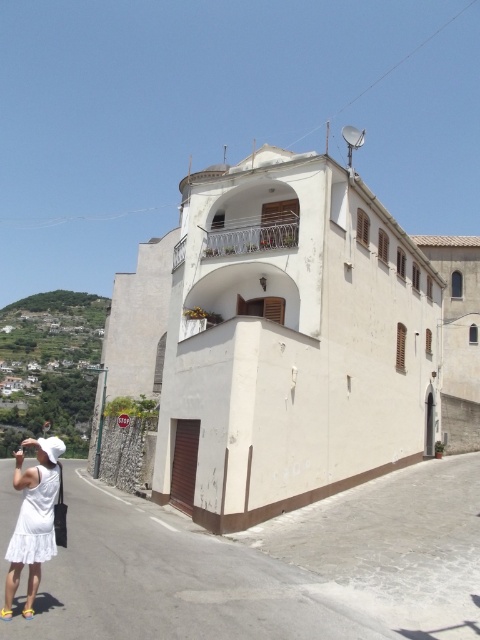
Question: Which point appears closest to the camera in this image?

Choices:
 (A) (23, 556)
 (B) (33, 588)

Answer: (B)

Question: Can you confirm if white cotton dress at lower left is positioned below white lace dress at lower left?

Choices:
 (A) no
 (B) yes

Answer: (B)

Question: Is the position of white cotton dress at lower left less distant than that of white lace dress at lower left?

Choices:
 (A) yes
 (B) no

Answer: (B)

Question: Can you confirm if white cotton dress at lower left is positioned above white lace dress at lower left?

Choices:
 (A) yes
 (B) no

Answer: (B)

Question: Which object is farther from the camera taking this photo?

Choices:
 (A) white lace dress at lower left
 (B) white cotton dress at lower left

Answer: (B)

Question: Among these points, which one is farthest from the camera?

Choices:
 (A) (46, 538)
 (B) (27, 497)

Answer: (B)